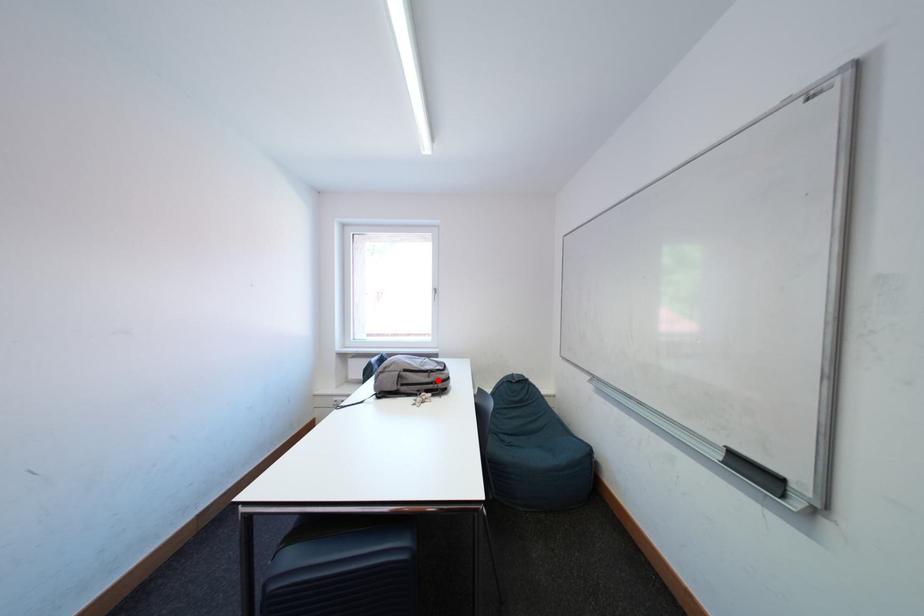
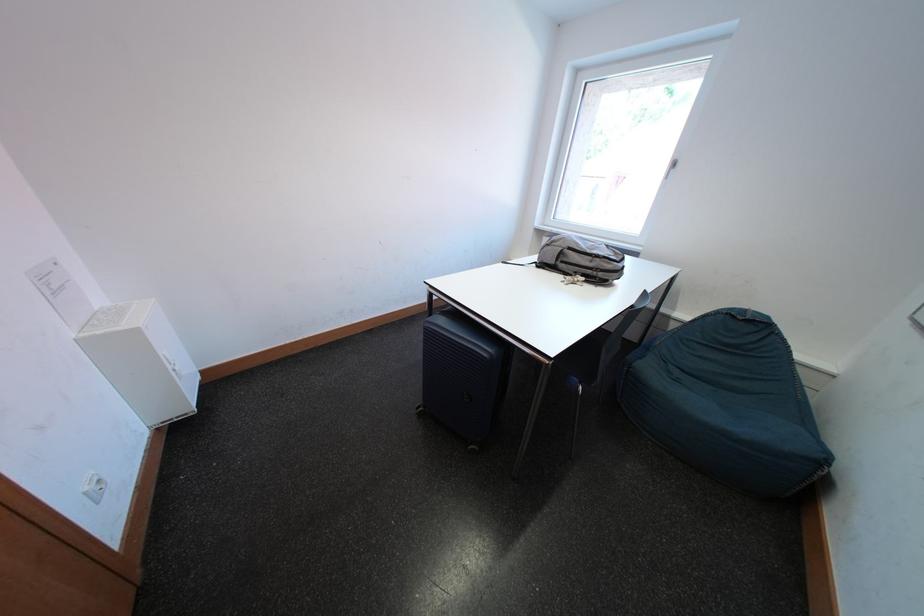
Question: A red point is marked in image1. In image2, is the corresponding 3D point closer to the camera or farther? Reply with the corresponding letter.

Choices:
 (A) The corresponding 3D point is closer.
 (B) The corresponding 3D point is farther.

Answer: (A)